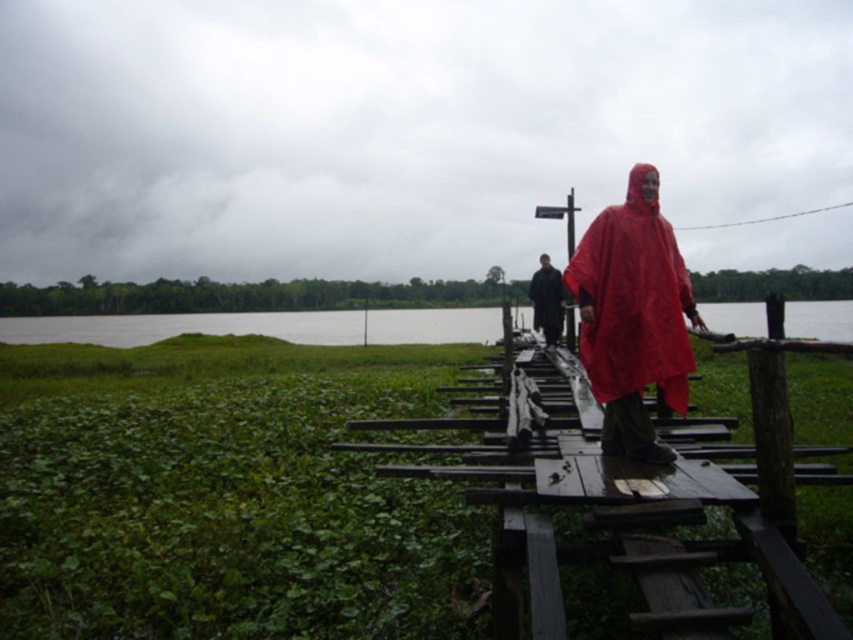
Question: Is wooden dock at center bigger than matte red poncho at center?

Choices:
 (A) no
 (B) yes

Answer: (A)

Question: Which object is closer to the camera taking this photo?

Choices:
 (A) matte black raincoat at center
 (B) green grass at lower left
 (C) wooden dock at center

Answer: (B)

Question: Can you confirm if wooden dock at center is positioned above matte black raincoat at center?

Choices:
 (A) no
 (B) yes

Answer: (A)

Question: Considering the real-world distances, which object is farthest from the matte black raincoat at center?

Choices:
 (A) wooden dock at center
 (B) matte red poncho at center
 (C) green grass at lower left

Answer: (C)

Question: Is green grass at lower left in front of matte black raincoat at center?

Choices:
 (A) yes
 (B) no

Answer: (A)

Question: Estimate the real-world distances between objects in this image. Which object is closer to the wooden dock at center?

Choices:
 (A) green grass at lower left
 (B) matte red poncho at center
 (C) matte black raincoat at center

Answer: (B)